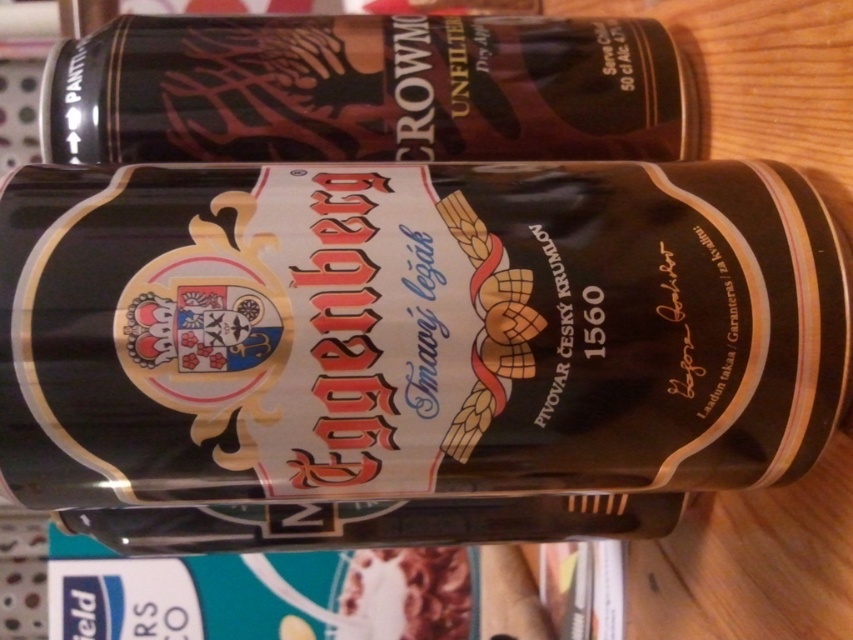
Between metallic gold beer can at center and matte black can at upper center, which one is positioned lower?

metallic gold beer can at center is lower down.

Does metallic gold beer can at center have a larger size compared to matte black can at upper center?

Indeed, metallic gold beer can at center has a larger size compared to matte black can at upper center.

Image resolution: width=853 pixels, height=640 pixels. I want to click on metallic gold beer can at center, so click(405, 339).

Find the location of `metallic gold beer can at center`. metallic gold beer can at center is located at coordinates (405, 339).